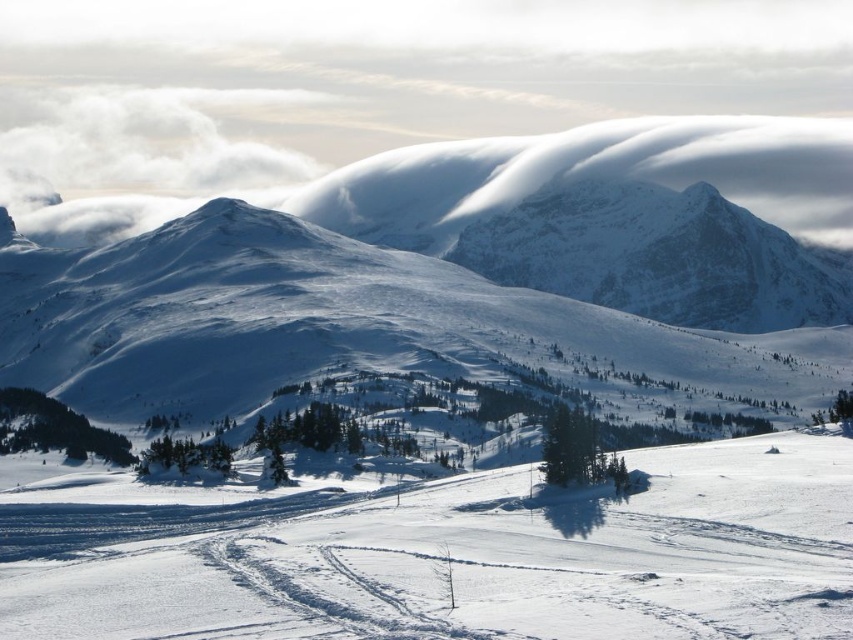
Can you confirm if white snow ski slope at center is smaller than white snow-covered mountain at center?

Correct, white snow ski slope at center occupies less space than white snow-covered mountain at center.

Locate an element on the screen. white snow ski slope at center is located at coordinates (444, 554).

Is point (624, 625) behind point (590, 332)?

No, it is not.

Where is `white snow ski slope at center`? The image size is (853, 640). white snow ski slope at center is located at coordinates (444, 554).